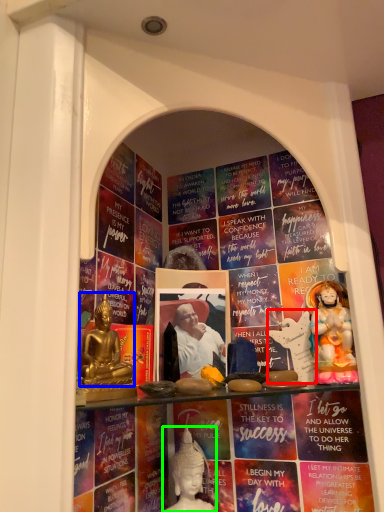
Question: Considering the real-world distances, which object is farthest from sculpture (highlighted by a red box)? person (highlighted by a blue box) or person (highlighted by a green box)?

Choices:
 (A) person
 (B) person

Answer: (A)